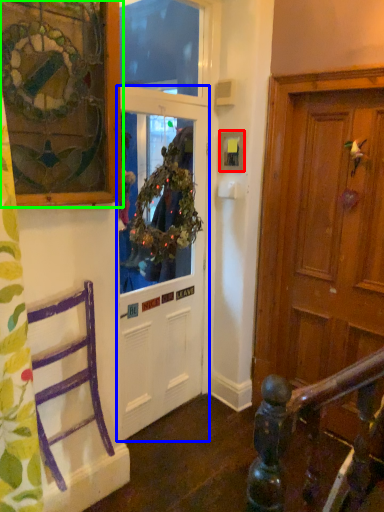
Question: Considering the real-world distances, which object is farthest from picture frame (highlighted by a red box)? door (highlighted by a blue box) or picture frame (highlighted by a green box)?

Choices:
 (A) door
 (B) picture frame

Answer: (B)